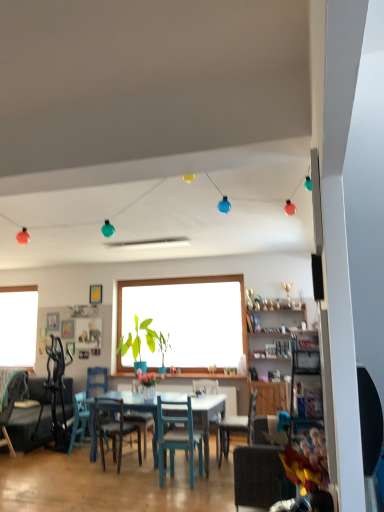
Question: Which is correct: teal wood chair at lower left, the 5th chair when ordered from right to left, is inside matte teal chair at center, which ranks as the 5th chair in left-to-right order, or outside of it?

Choices:
 (A) outside
 (B) inside

Answer: (A)

Question: Would you say teal wood chair at lower left, the 5th chair when ordered from right to left, is to the left or to the right of matte teal chair at center, which ranks as the 5th chair in left-to-right order, in the picture?

Choices:
 (A) left
 (B) right

Answer: (A)

Question: Which object is positioned closest to the wooden picture frame at left, which is the third picture frame from right to left?

Choices:
 (A) wooden cabinet at center
 (B) black matte speaker at right
 (C) wooden picture frame at center, placed as the second picture frame when sorted from left to right
 (D) matte teal chair at center, the 2th chair from the right
 (E) wooden chair at center, which is the 3th chair from left to right

Answer: (C)

Question: Considering the real-world distances, which object is farthest from the teal fabric chair at lower left, marked as the 6th chair in a right-to-left arrangement?

Choices:
 (A) green matte plant at center
 (B) wooden chair at center, which is the 3th chair from left to right
 (C) velvet teal chair at lower right, arranged as the 6th chair when viewed from the left
 (D) matte teal chair at center, which ranks as the 5th chair in left-to-right order
 (E) wooden picture frame at center, the second picture frame viewed from the right

Answer: (C)